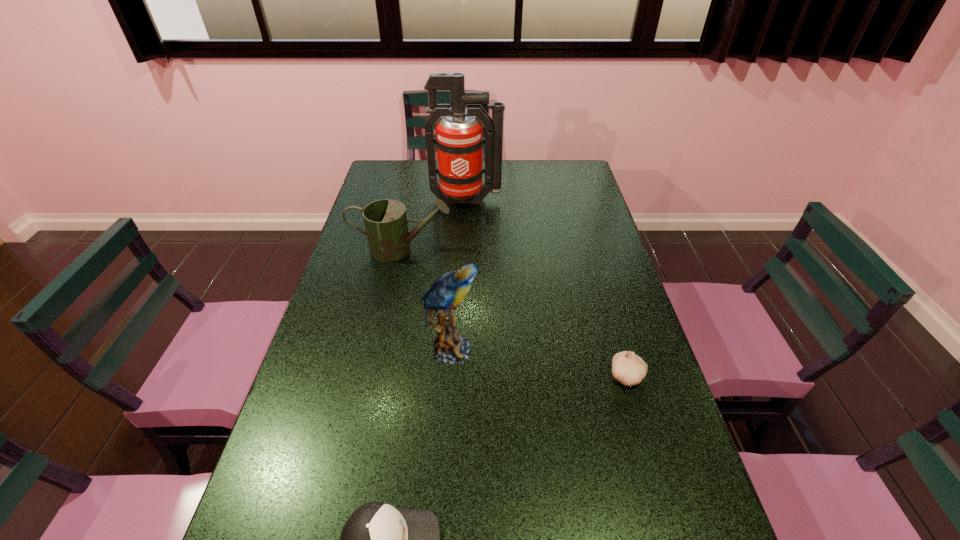
Image resolution: width=960 pixels, height=540 pixels. Identify the location of object positioned at the far edge. (459, 138).

Locate an element on the screen. object at the left edge is located at coordinates (385, 220).

Where is `object located at the right edge`? object located at the right edge is located at coordinates (628, 368).

Locate an element on the screen. vacant space at the left edge of the desktop is located at coordinates (309, 483).

The image size is (960, 540). In the image, there is a desktop. Identify the location of free space at the right edge. click(x=588, y=194).

Where is `free location at the far right corner of the desktop`? This screenshot has width=960, height=540. free location at the far right corner of the desktop is located at coordinates click(x=583, y=183).

The image size is (960, 540). What are the coordinates of `empty location between the garlic and the parrot` in the screenshot? It's located at (539, 362).

Locate an element on the screen. The height and width of the screenshot is (540, 960). free space between the second tallest object and the rightmost object is located at coordinates (539, 362).

Image resolution: width=960 pixels, height=540 pixels. Find the location of `vacant point located between the fire extinguisher and the garlic`. vacant point located between the fire extinguisher and the garlic is located at coordinates (547, 288).

The height and width of the screenshot is (540, 960). I want to click on free space that is in between the farthest object and the rightmost object, so click(x=547, y=288).